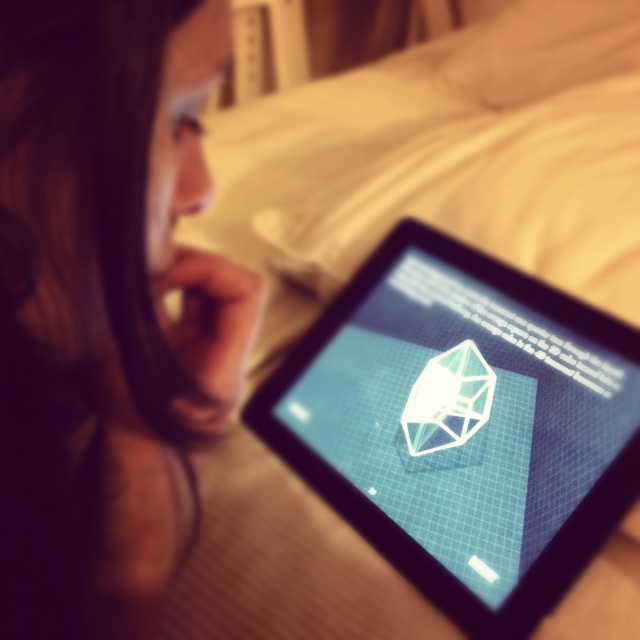
You are a photographer trying to focus on the tablet screen in the image. The tablet screen has a 3D model displayed on it. There is a specific point marked at point (106, 307). Can you tell me what object is located at that coordinate?

The brown hair at upper left is located at point (106, 307).

You are a photographer trying to capture a clear shot of the transparent glass tablet at center. However, the brown hair at upper left is partially obscuring your view. Based on their sizes, can you determine which object is narrower and might allow you to adjust your angle to avoid obstruction?

The brown hair at upper left has a lesser width compared to the transparent glass tablet at center, so it is narrower. Adjusting your angle to move around the narrower brown hair at upper left could help capture a clear view of the transparent glass tablet at center.